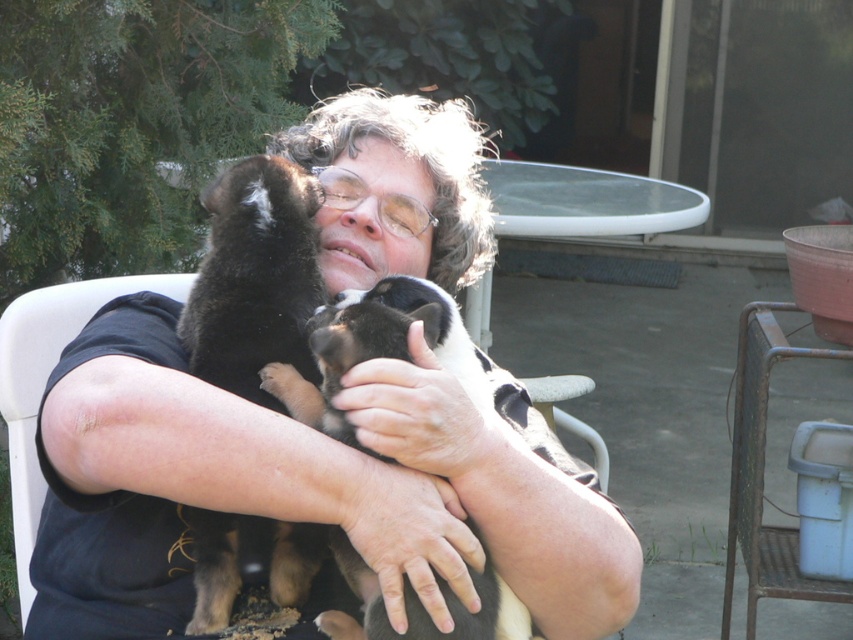
Is black fabric shirt at center thinner than black fur puppy at left?

In fact, black fabric shirt at center might be wider than black fur puppy at left.

Looking at this image, which is above, black fabric shirt at center or black fur puppy at left?

black fabric shirt at center

Between point (373, 109) and point (253, 372), which one is positioned behind?

The point (373, 109) is more distant.

Locate an element on the screen. The height and width of the screenshot is (640, 853). black fabric shirt at center is located at coordinates (300, 490).